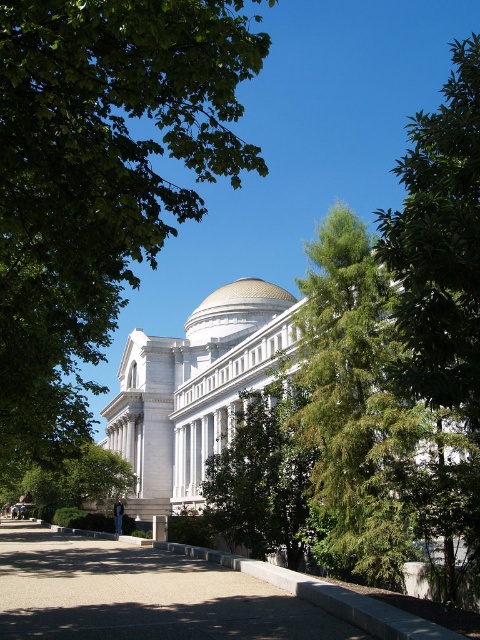
You are standing at the entrance of the grand neoclassical building and notice a point marked at coordinates (98, 182). What object does this point correspond to?

The point at coordinates (98, 182) corresponds to the green leafy tree at upper left.

You are standing at the entrance of the grand neoclassical building and want to walk towards the point marked as point (253, 289). However, there is an obstacle at point (381, 445). Will you encounter this obstacle before reaching your destination?

Yes, you will encounter the obstacle at point (381, 445) before reaching your destination at point (253, 289) because point (381, 445) is in front of point (253, 289).